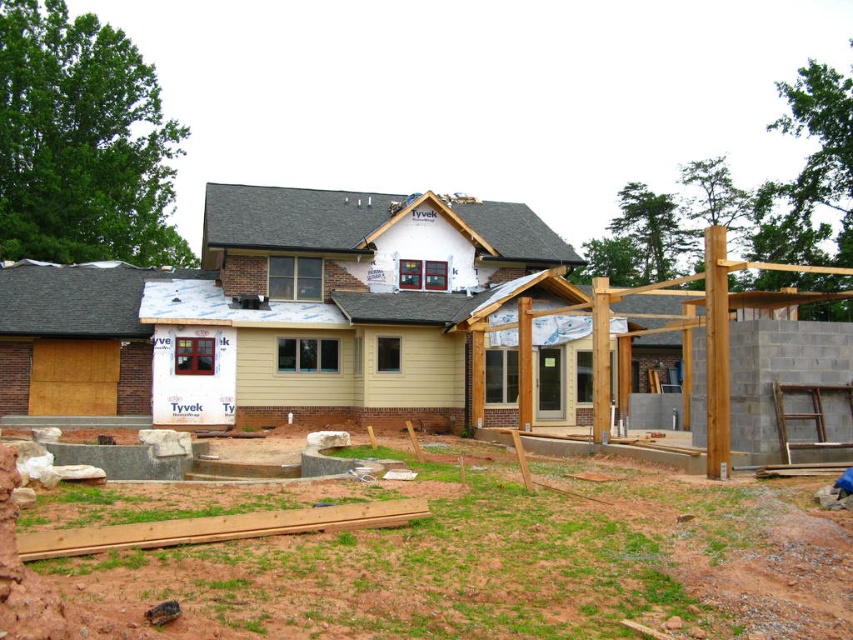
Question: Can you confirm if beige siding at center is smaller than green grass at lower center?

Choices:
 (A) yes
 (B) no

Answer: (B)

Question: Which of the following is the closest to the observer?

Choices:
 (A) (282, 211)
 (B) (641, 589)

Answer: (B)

Question: Among these objects, which one is farthest from the camera?

Choices:
 (A) beige siding at center
 (B) green grass at lower center

Answer: (A)

Question: Considering the relative positions of beige siding at center and green grass at lower center in the image provided, where is beige siding at center located with respect to green grass at lower center?

Choices:
 (A) above
 (B) below

Answer: (A)

Question: Which point is closer to the camera?

Choices:
 (A) green grass at lower center
 (B) beige siding at center

Answer: (A)

Question: Is beige siding at center to the left of green grass at lower center from the viewer's perspective?

Choices:
 (A) yes
 (B) no

Answer: (B)